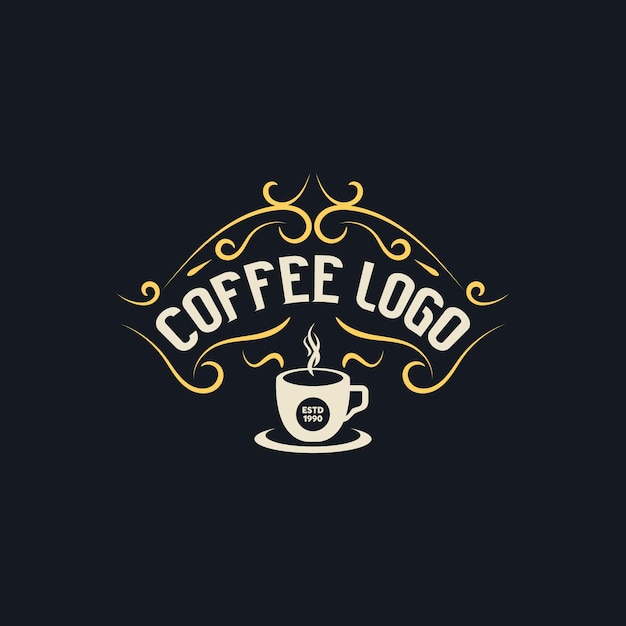
Identify the location of white coffee cup, center. (334, 404).